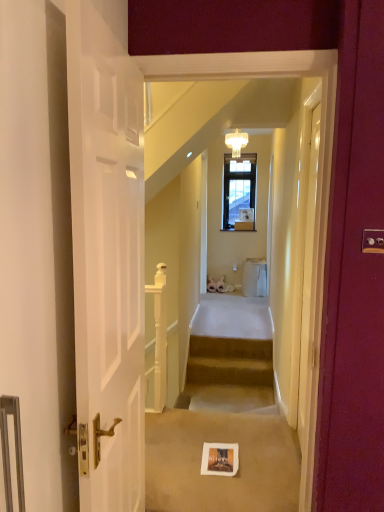
Question: Is white glossy door at upper center, placed as the second door when sorted from front to back, with white matte door at left, acting as the second door starting from the right?

Choices:
 (A) no
 (B) yes

Answer: (A)

Question: From the image's perspective, is white glossy door at upper center, the first door when ordered from back to front, above white matte door at left, the 1th door viewed from the front?

Choices:
 (A) no
 (B) yes

Answer: (A)

Question: Is white glossy door at upper center, the second door positioned from the left, to the left of white matte door at left, acting as the second door starting from the right, from the viewer's perspective?

Choices:
 (A) yes
 (B) no

Answer: (B)

Question: Is white glossy door at upper center, the first door when ordered from back to front, positioned with its back to white matte door at left, the 1th door viewed from the front?

Choices:
 (A) yes
 (B) no

Answer: (B)

Question: From a real-world perspective, is white glossy door at upper center, the first door from the right, positioned under white matte door at left, the second door viewed from the back, based on gravity?

Choices:
 (A) yes
 (B) no

Answer: (A)

Question: Considering the relative sizes of white glossy door at upper center, placed as the second door when sorted from front to back, and white matte door at left, acting as the second door starting from the right, in the image provided, is white glossy door at upper center, placed as the second door when sorted from front to back, bigger than white matte door at left, acting as the second door starting from the right,?

Choices:
 (A) yes
 (B) no

Answer: (B)

Question: From the image's perspective, does white glossy balustrade at center appear higher than white matte door at left, which is counted as the 1th door, starting from the left?

Choices:
 (A) no
 (B) yes

Answer: (A)

Question: Is white glossy balustrade at center wider than white matte door at left, which is counted as the 1th door, starting from the left?

Choices:
 (A) no
 (B) yes

Answer: (B)

Question: Considering the relative sizes of white glossy balustrade at center and white matte door at left, acting as the second door starting from the right, in the image provided, is white glossy balustrade at center smaller than white matte door at left, acting as the second door starting from the right,?

Choices:
 (A) yes
 (B) no

Answer: (A)

Question: Is white glossy balustrade at center oriented towards white matte door at left, the 1th door viewed from the front?

Choices:
 (A) yes
 (B) no

Answer: (B)

Question: Is white glossy balustrade at center positioned in front of white matte door at left, the 1th door viewed from the front?

Choices:
 (A) no
 (B) yes

Answer: (A)

Question: Considering the relative sizes of white glossy balustrade at center and white matte door at left, acting as the second door starting from the right, in the image provided, is white glossy balustrade at center thinner than white matte door at left, acting as the second door starting from the right,?

Choices:
 (A) yes
 (B) no

Answer: (B)

Question: Is white matte door at left, which is counted as the 1th door, starting from the left, wider than white glossy door at upper center, the first door when ordered from back to front?

Choices:
 (A) no
 (B) yes

Answer: (B)